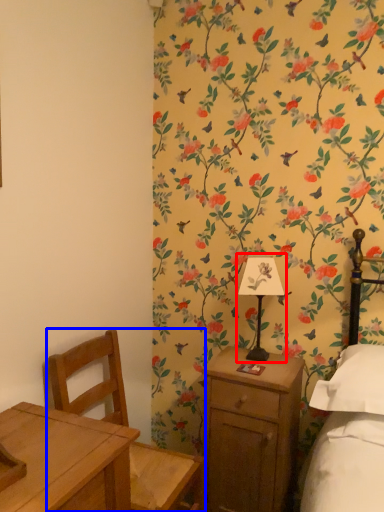
Question: Which object appears closest to the camera in this image, bedside lamp (highlighted by a red box) or chair (highlighted by a blue box)?

Choices:
 (A) bedside lamp
 (B) chair

Answer: (B)